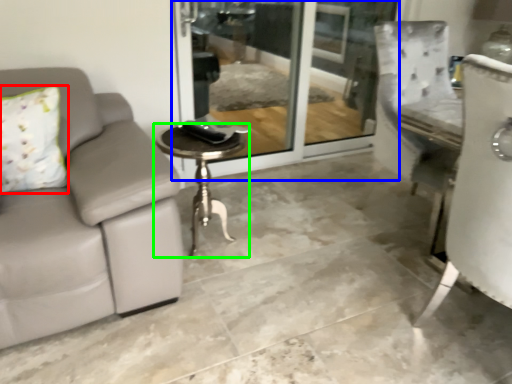
Question: Which object is the farthest from pillow (highlighted by a red box)? Choose among these: screen door (highlighted by a blue box) or table (highlighted by a green box).

Choices:
 (A) screen door
 (B) table

Answer: (A)